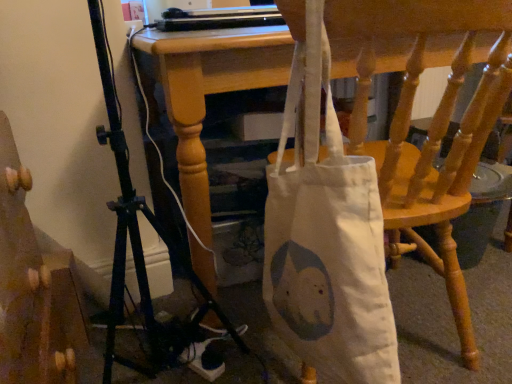
Question: Looking at their shapes, would you say white fabric bag at lower center is wider or thinner than wooden staircase at lower left?

Choices:
 (A) thin
 (B) wide

Answer: (B)

Question: Considering the positions of point pos(453,71) and point pos(77,360), is point pos(453,71) closer or farther from the camera than point pos(77,360)?

Choices:
 (A) farther
 (B) closer

Answer: (B)

Question: Based on their sizes in the image, would you say white fabric bag at lower center is bigger or smaller than wooden staircase at lower left?

Choices:
 (A) big
 (B) small

Answer: (A)

Question: From a real-world perspective, relative to white fabric bag at lower center, is wooden staircase at lower left vertically above or below?

Choices:
 (A) above
 (B) below

Answer: (A)

Question: Is wooden staircase at lower left inside the boundaries of white fabric bag at lower center, or outside?

Choices:
 (A) inside
 (B) outside

Answer: (B)

Question: Is point (29, 183) positioned closer to the camera than point (370, 150)?

Choices:
 (A) farther
 (B) closer

Answer: (B)

Question: Considering the positions of wooden staircase at lower left and white fabric bag at lower center in the image, is wooden staircase at lower left wider or thinner than white fabric bag at lower center?

Choices:
 (A) thin
 (B) wide

Answer: (A)